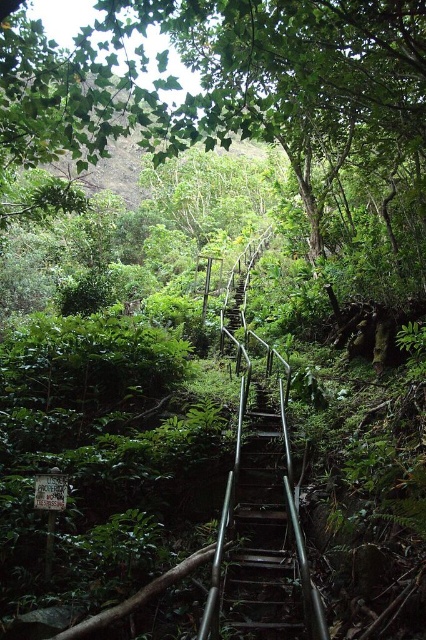
Question: Is green leafy tree at upper center to the left of metallic silver stairs at center from the viewer's perspective?

Choices:
 (A) no
 (B) yes

Answer: (B)

Question: Does green leafy tree at upper center have a larger size compared to metallic silver stairs at center?

Choices:
 (A) no
 (B) yes

Answer: (B)

Question: Which point is farther to the camera?

Choices:
 (A) (305, 195)
 (B) (252, 627)

Answer: (A)

Question: In this image, where is green leafy tree at upper center located relative to metallic silver stairs at center?

Choices:
 (A) right
 (B) left

Answer: (B)

Question: Which of the following is the closest to the observer?

Choices:
 (A) (244, 480)
 (B) (362, 120)

Answer: (A)